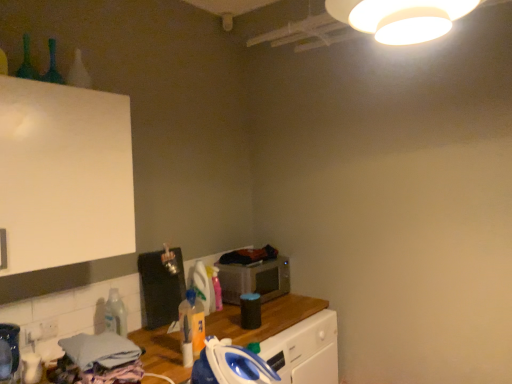
Question: From the image's perspective, is blue plastic iron at lower center beneath translucent plastic bottle at center, the 1th bottle in the right-to-left sequence?

Choices:
 (A) yes
 (B) no

Answer: (A)

Question: From a real-world perspective, is blue plastic iron at lower center positioned over translucent plastic bottle at center, the 1th bottle in the right-to-left sequence, based on gravity?

Choices:
 (A) yes
 (B) no

Answer: (B)

Question: Is blue plastic iron at lower center looking in the opposite direction of translucent plastic bottle at center, which is the third bottle in left-to-right order?

Choices:
 (A) yes
 (B) no

Answer: (B)

Question: Is blue plastic iron at lower center at the left side of translucent plastic bottle at center, the 1th bottle in the right-to-left sequence?

Choices:
 (A) yes
 (B) no

Answer: (B)

Question: Is the depth of blue plastic iron at lower center greater than that of translucent plastic bottle at center, which appears as the 2th bottle when viewed from the back?

Choices:
 (A) yes
 (B) no

Answer: (B)

Question: Is blue plastic iron at lower center at the right side of translucent plastic bottle at center, which appears as the second bottle when viewed from the front?

Choices:
 (A) no
 (B) yes

Answer: (B)

Question: From a real-world perspective, is metallic silver microwave at center located beneath green glass bottle at upper left, which is the first bottle from top to bottom?

Choices:
 (A) no
 (B) yes

Answer: (B)

Question: Considering the relative sizes of metallic silver microwave at center and green glass bottle at upper left, which is the first bottle from top to bottom, in the image provided, is metallic silver microwave at center smaller than green glass bottle at upper left, which is the first bottle from top to bottom,?

Choices:
 (A) no
 (B) yes

Answer: (A)

Question: Does metallic silver microwave at center come in front of green glass bottle at upper left, which is the first bottle from top to bottom?

Choices:
 (A) no
 (B) yes

Answer: (A)

Question: From the image's perspective, is metallic silver microwave at center beneath green glass bottle at upper left, which is the first bottle from top to bottom?

Choices:
 (A) yes
 (B) no

Answer: (A)

Question: Considering the relative sizes of metallic silver microwave at center and green glass bottle at upper left, which is the 1th bottle in front-to-back order, in the image provided, is metallic silver microwave at center bigger than green glass bottle at upper left, which is the 1th bottle in front-to-back order,?

Choices:
 (A) no
 (B) yes

Answer: (B)

Question: Is metallic silver microwave at center at the right side of green glass bottle at upper left, which is the third bottle in back-to-front order?

Choices:
 (A) yes
 (B) no

Answer: (A)

Question: Is metallic silver microwave at center further to the viewer compared to clear plastic bottle at lower left, marked as the third bottle in a top-to-bottom arrangement?

Choices:
 (A) yes
 (B) no

Answer: (A)